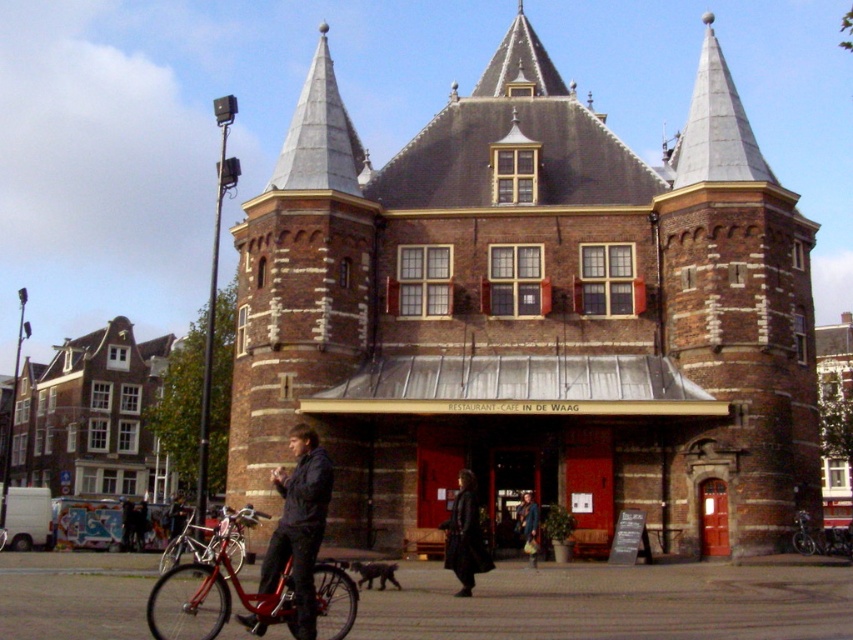
Question: Can you confirm if brown brick building at center is positioned below denim jacket at center?

Choices:
 (A) yes
 (B) no

Answer: (B)

Question: Which object appears closest to the camera in this image?

Choices:
 (A) brown brick building at center
 (B) denim jacket at center

Answer: (B)

Question: Which object appears farthest from the camera in this image?

Choices:
 (A) shiny red bicycle at lower left
 (B) brown brick building at center
 (C) dark brown leather coat at center

Answer: (B)

Question: Which object is closer to the camera taking this photo?

Choices:
 (A) black matte jacket at center
 (B) dark brown leather coat at center

Answer: (A)

Question: Is black matte jacket at center above dark brown leather coat at center?

Choices:
 (A) no
 (B) yes

Answer: (B)

Question: Does shiny red bicycle at lower left appear on the right side of denim jacket at center?

Choices:
 (A) yes
 (B) no

Answer: (B)